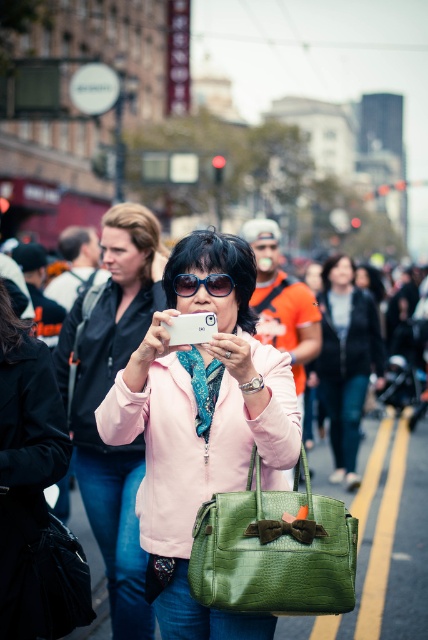
You are a fashion designer observing the scene. You notice the matte pink jacket at center and the matte green leather bag at center. Which clothing item is covering part of the other?

The matte pink jacket at center is positioned over the matte green leather bag at center, so the jacket is covering part of the bag.

You are a fashion blogger analyzing the outfits in the scene. You notice two similar items on the woman in the center. The first is a matte green handbag at center, and the second is a matte green leather bag at center. Which of these two items appears smaller in height?

The matte green handbag at center has a lesser height compared to the matte green leather bag at center, so the matte green handbag at center appears smaller in height.